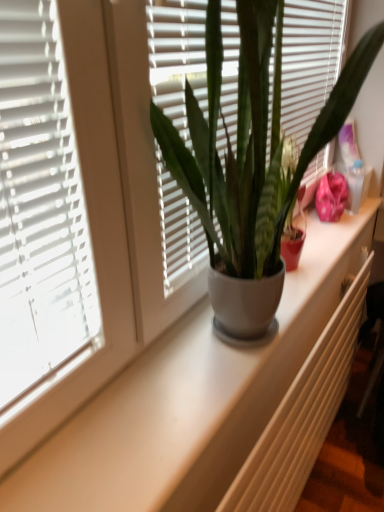
Question: From a real-world perspective, relative to white textured radiator at center, is matte gray pot at center vertically above or below?

Choices:
 (A) below
 (B) above

Answer: (B)

Question: From the image's perspective, relative to white textured radiator at center, is matte gray pot at center above or below?

Choices:
 (A) above
 (B) below

Answer: (A)

Question: Considering the positions of point (190, 156) and point (365, 280), is point (190, 156) closer or farther from the camera than point (365, 280)?

Choices:
 (A) closer
 (B) farther

Answer: (A)

Question: In terms of width, does white textured radiator at center look wider or thinner when compared to matte gray pot at center?

Choices:
 (A) thin
 (B) wide

Answer: (A)

Question: Considering their positions, is white textured radiator at center located in front of or behind matte gray pot at center?

Choices:
 (A) front
 (B) behind

Answer: (B)

Question: From a real-world perspective, is white textured radiator at center above or below matte gray pot at center?

Choices:
 (A) above
 (B) below

Answer: (B)

Question: From the image's perspective, is white textured radiator at center positioned above or below matte gray pot at center?

Choices:
 (A) below
 (B) above

Answer: (A)